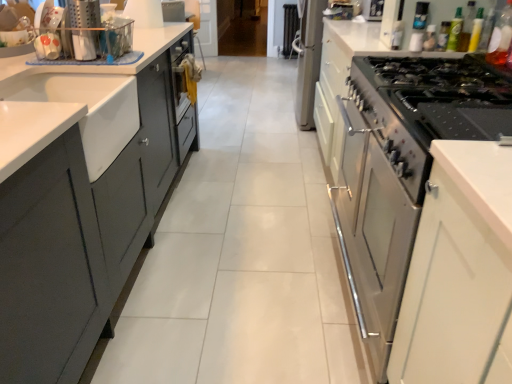
What do you see at coordinates (84, 28) in the screenshot?
I see `metallic grater at upper left` at bounding box center [84, 28].

Describe the element at coordinates (430, 38) in the screenshot. I see `green glass bottle at upper right, the sixth bottle in the right-to-left sequence` at that location.

Locate an element on the screen. Image resolution: width=512 pixels, height=384 pixels. green glass bottle at upper right, the sixth bottle in the right-to-left sequence is located at coordinates (430, 38).

What do you see at coordinates (455, 31) in the screenshot? The width and height of the screenshot is (512, 384). I see `green matte bottle at upper right, positioned as the fifth bottle in right-to-left order` at bounding box center [455, 31].

You are a GUI agent. You are given a task and a screenshot of the screen. Output one action in this format:
    pyautogui.click(x=<x>, y=<y>)
    Task: Click on the black glass gas stove at right
    
    Given the screenshot: What is the action you would take?
    pyautogui.click(x=439, y=96)

Considering the relative positions of satin white oven at right and metallic grater at upper left in the image provided, is satin white oven at right to the right of metallic grater at upper left from the viewer's perspective?

Correct, you'll find satin white oven at right to the right of metallic grater at upper left.

Considering the relative sizes of satin white oven at right and metallic grater at upper left in the image provided, is satin white oven at right bigger than metallic grater at upper left?

Indeed, satin white oven at right has a larger size compared to metallic grater at upper left.

Between point (448, 92) and point (96, 52), which one is positioned behind?

Point (96, 52)

Is green glass bottle at upper right, marked as the 1th bottle in a left-to-right arrangement, oriented towards satin white oven at right?

No, green glass bottle at upper right, marked as the 1th bottle in a left-to-right arrangement, is not oriented towards satin white oven at right.

Is the surface of green glass bottle at upper right, the sixth bottle in the right-to-left sequence, in direct contact with satin white oven at right?

No, green glass bottle at upper right, the sixth bottle in the right-to-left sequence, is not in contact with satin white oven at right.

Looking at this image, does green glass bottle at upper right, marked as the 1th bottle in a left-to-right arrangement, have a greater height compared to satin white oven at right?

No, green glass bottle at upper right, marked as the 1th bottle in a left-to-right arrangement, is not taller than satin white oven at right.

You are a GUI agent. You are given a task and a screenshot of the screen. Output one action in this format:
    pyautogui.click(x=<x>, y=<y>)
    Task: Click on the bottle on the left side of green matte bottle at upper right, positioned as the fifth bottle in right-to-left order
    
    Given the screenshot: What is the action you would take?
    pyautogui.click(x=430, y=38)

Which object is more forward, green matte bottle at upper right, positioned as the fifth bottle in right-to-left order, or green glass bottle at upper right, the sixth bottle in the right-to-left sequence?

green matte bottle at upper right, positioned as the fifth bottle in right-to-left order, is closer to the camera.

Considering the relative sizes of green matte bottle at upper right, positioned as the fifth bottle in right-to-left order, and green glass bottle at upper right, the sixth bottle in the right-to-left sequence, in the image provided, is green matte bottle at upper right, positioned as the fifth bottle in right-to-left order, smaller than green glass bottle at upper right, the sixth bottle in the right-to-left sequence,?

No.

Considering the sizes of objects green matte bottle at upper right, positioned as the fifth bottle in right-to-left order, and green glass bottle at upper right, marked as the 1th bottle in a left-to-right arrangement, in the image provided, who is thinner, green matte bottle at upper right, positioned as the fifth bottle in right-to-left order, or green glass bottle at upper right, marked as the 1th bottle in a left-to-right arrangement,?

green matte bottle at upper right, positioned as the fifth bottle in right-to-left order, is thinner.

From the picture: Are translucent plastic bottle at upper right, the third bottle viewed from the right, and matte plastic utensil holder at upper left making contact?

No.

Based on their positions, is translucent plastic bottle at upper right, which is counted as the 4th bottle, starting from the left, located to the left or right of matte plastic utensil holder at upper left?

Clearly, translucent plastic bottle at upper right, which is counted as the 4th bottle, starting from the left, is on the right of matte plastic utensil holder at upper left in the image.

From a real-world perspective, is translucent plastic bottle at upper right, the third bottle viewed from the right, located higher than matte plastic utensil holder at upper left?

Indeed, from a real-world perspective, translucent plastic bottle at upper right, the third bottle viewed from the right, stands above matte plastic utensil holder at upper left.

Is translucent plastic bottle at upper right, the third bottle viewed from the right, aimed at matte plastic utensil holder at upper left?

Yes.

Is green glass bottle at upper right, the fourth bottle viewed from the right, wider or thinner than satin white oven at right?

Considering their sizes, green glass bottle at upper right, the fourth bottle viewed from the right, looks slimmer than satin white oven at right.

Is the position of green glass bottle at upper right, the third bottle from the left, less distant than that of satin white oven at right?

No, green glass bottle at upper right, the third bottle from the left, is behind satin white oven at right.

At what (x,y) coordinates should I click in order to perform the action: click on cabinetry to the left of green glass bottle at upper right, the fourth bottle viewed from the right. Please return your answer as a coordinate pair (x, y). Looking at the image, I should click on tap(392, 155).

Is green glass bottle at upper right, the fourth bottle viewed from the right, next to satin white oven at right and touching it?

They are not placed beside each other.

From a real-world perspective, is green matte bottle at upper right, positioned as the fifth bottle in right-to-left order, positioned above or below transparent plastic bottle at upper right, the 6th bottle in the left-to-right sequence?

In terms of real-world spatial position, green matte bottle at upper right, positioned as the fifth bottle in right-to-left order, is above transparent plastic bottle at upper right, the 6th bottle in the left-to-right sequence.

Which of these two, green matte bottle at upper right, positioned as the fifth bottle in right-to-left order, or transparent plastic bottle at upper right, placed as the 1th bottle when sorted from right to left, stands taller?

Standing taller between the two is transparent plastic bottle at upper right, placed as the 1th bottle when sorted from right to left.

Between green matte bottle at upper right, which is the second bottle in left-to-right order, and transparent plastic bottle at upper right, the 6th bottle in the left-to-right sequence, which one appears on the left side from the viewer's perspective?

From the viewer's perspective, green matte bottle at upper right, which is the second bottle in left-to-right order, appears more on the left side.

Where is `bottle that is the 4th object to the right of the green matte bottle at upper right, positioned as the fifth bottle in right-to-left order, starting at the anchor`? The width and height of the screenshot is (512, 384). bottle that is the 4th object to the right of the green matte bottle at upper right, positioned as the fifth bottle in right-to-left order, starting at the anchor is located at coordinates (487, 29).

Between satin white oven at right and green glass bottle at upper right, the fourth bottle viewed from the right, which one has more height?

With more height is satin white oven at right.

From a real-world perspective, which is physically below, satin white oven at right or green glass bottle at upper right, the third bottle from the left?

satin white oven at right is physically lower.

The width and height of the screenshot is (512, 384). Find the location of `cabinetry below the metallic grater at upper left (from a real-world perspective)`. cabinetry below the metallic grater at upper left (from a real-world perspective) is located at coordinates pos(392,155).

Where is `bottle that is the 6th object located behind the satin white oven at right`? The image size is (512, 384). bottle that is the 6th object located behind the satin white oven at right is located at coordinates tap(430, 38).

Looking at the image, which one is located further to green glass bottle at upper right, the third bottle from the left, green plastic bottle at upper right, which is the 2th bottle from right to left, or transparent plastic bottle at upper right, placed as the 1th bottle when sorted from right to left?

The object further to green glass bottle at upper right, the third bottle from the left, is transparent plastic bottle at upper right, placed as the 1th bottle when sorted from right to left.

Looking at the image, which one is located closer to green plastic bottle at upper right, which ranks as the fifth bottle in left-to-right order, satin white oven at right or metallic grater at upper left?

satin white oven at right is closer to green plastic bottle at upper right, which ranks as the fifth bottle in left-to-right order.

Looking at the image, which one is located closer to black glass gas stove at right, translucent plastic bottle at upper right, which is counted as the 4th bottle, starting from the left, or metallic grater at upper left?

translucent plastic bottle at upper right, which is counted as the 4th bottle, starting from the left, is closer to black glass gas stove at right.

Looking at the image, which one is located closer to green glass bottle at upper right, the sixth bottle in the right-to-left sequence, satin white oven at right or green matte bottle at upper right, which is the second bottle in left-to-right order?

green matte bottle at upper right, which is the second bottle in left-to-right order, is positioned closer to the anchor green glass bottle at upper right, the sixth bottle in the right-to-left sequence.

Based on their spatial positions, is green plastic bottle at upper right, which is the 2th bottle from right to left, or green matte bottle at upper right, positioned as the fifth bottle in right-to-left order, further from satin white oven at right?

Based on the image, green plastic bottle at upper right, which is the 2th bottle from right to left, appears to be further to satin white oven at right.

Considering their positions, is matte plastic utensil holder at upper left positioned closer to transparent plastic bottle at upper right, the 6th bottle in the left-to-right sequence, than green glass bottle at upper right, marked as the 1th bottle in a left-to-right arrangement?

The object closer to transparent plastic bottle at upper right, the 6th bottle in the left-to-right sequence, is green glass bottle at upper right, marked as the 1th bottle in a left-to-right arrangement.

Looking at the image, which one is located further to black glass gas stove at right, translucent plastic bottle at upper right, which is counted as the 4th bottle, starting from the left, or green glass bottle at upper right, the third bottle from the left?

Among the two, green glass bottle at upper right, the third bottle from the left, is located further to black glass gas stove at right.

Considering their positions, is transparent plastic bottle at upper right, the 6th bottle in the left-to-right sequence, positioned further to green matte bottle at upper right, positioned as the fifth bottle in right-to-left order, than green plastic bottle at upper right, which ranks as the fifth bottle in left-to-right order?

transparent plastic bottle at upper right, the 6th bottle in the left-to-right sequence, is further to green matte bottle at upper right, positioned as the fifth bottle in right-to-left order.

At what (x,y) coordinates should I click in order to perform the action: click on gas stove between metallic grater at upper left and green glass bottle at upper right, the fourth bottle viewed from the right. Please return your answer as a coordinate pair (x, y). Looking at the image, I should click on (439, 96).

Where is `cabinetry between white matte sink at left and green matte bottle at upper right, which is the second bottle in left-to-right order, in the horizontal direction`? cabinetry between white matte sink at left and green matte bottle at upper right, which is the second bottle in left-to-right order, in the horizontal direction is located at coordinates (392, 155).

Find the location of a particular element. cabinetry between metallic grater at upper left and translucent plastic bottle at upper right, which is counted as the 4th bottle, starting from the left, in the horizontal direction is located at coordinates (392, 155).

You are a GUI agent. You are given a task and a screenshot of the screen. Output one action in this format:
    pyautogui.click(x=<x>, y=<y>)
    Task: Click on the appliance located between matte plastic utensil holder at upper left and green glass bottle at upper right, the third bottle from the left, in the left-right direction
    The image size is (512, 384).
    Given the screenshot: What is the action you would take?
    pyautogui.click(x=84, y=28)